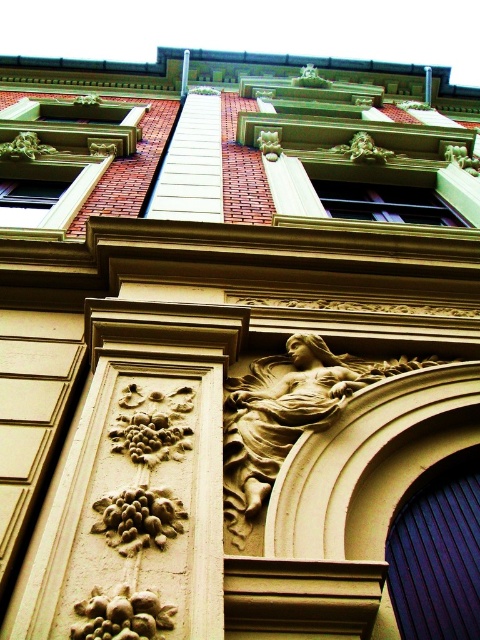
You are standing 10 feet away from the building facade and want to touch the point at coordinate point [56,627]. Can you reach it without moving closer?

The distance of point [56,627] from viewer is 12.96 feet, so you are currently 10 feet away from the building facade. Since 10 feet is less than 12.96 feet, you are closer than the point, meaning the point is behind you. Therefore, you cannot reach it without moving closer.

In the scene shown: You are an architect examining the building facade. You need to locate the carved stone column at center. What are its coordinates?

The carved stone column at center is located at coordinates point (136, 483).